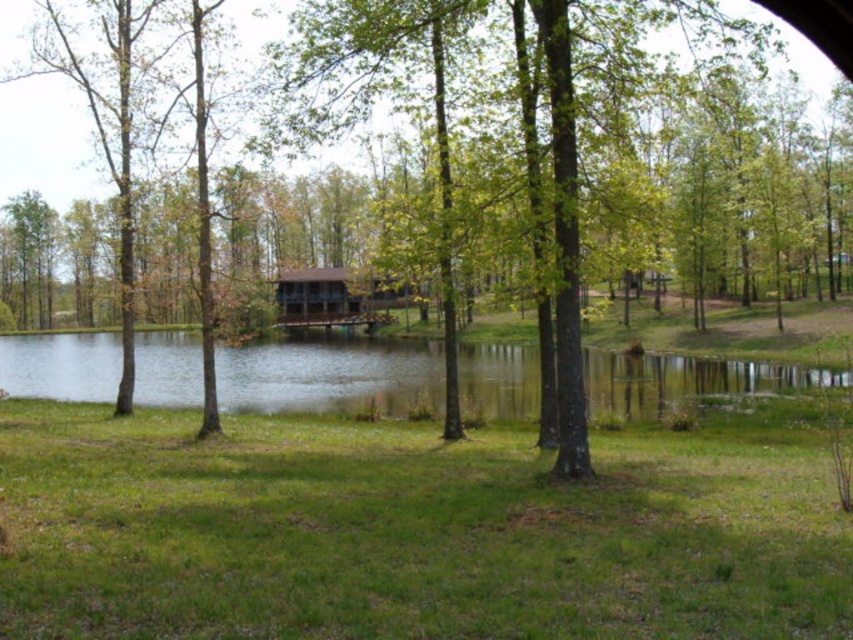
Who is positioned more to the left, clear water at center or brown wooden cabin at center?

Positioned to the left is clear water at center.

Is clear water at center wider than brown wooden cabin at center?

Yes.

Locate an element on the screen. The width and height of the screenshot is (853, 640). clear water at center is located at coordinates (329, 376).